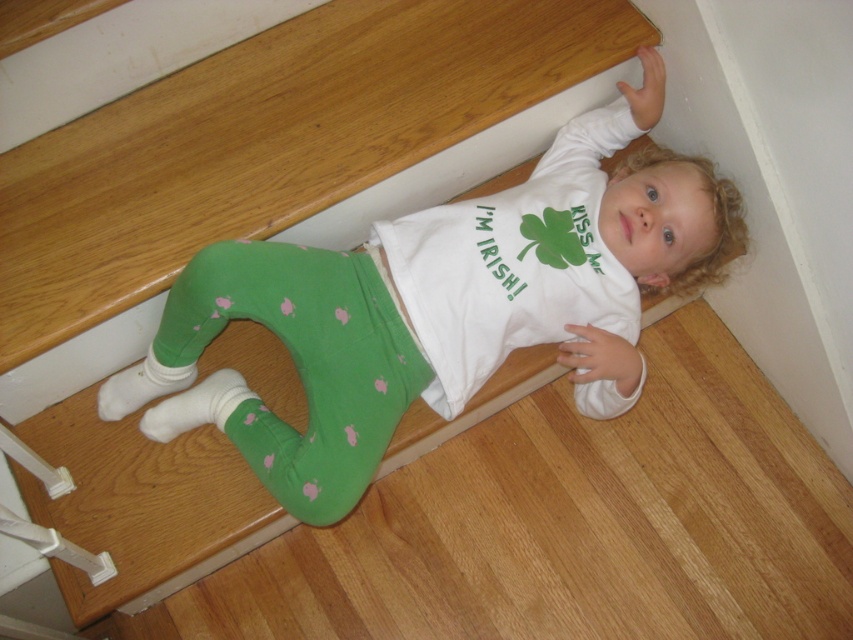
Question: Does green cotton leggings at lower center appear under green polka dot leggings at lower center?

Choices:
 (A) no
 (B) yes

Answer: (A)

Question: Which point is closer to the camera?

Choices:
 (A) (387, 314)
 (B) (310, 508)

Answer: (B)

Question: Where is green cotton leggings at lower center located in relation to green polka dot leggings at lower center in the image?

Choices:
 (A) left
 (B) right

Answer: (B)

Question: Is green cotton leggings at lower center further to the viewer compared to green polka dot leggings at lower center?

Choices:
 (A) yes
 (B) no

Answer: (A)

Question: Which point appears farthest from the camera in this image?

Choices:
 (A) (312, 323)
 (B) (312, 371)

Answer: (A)